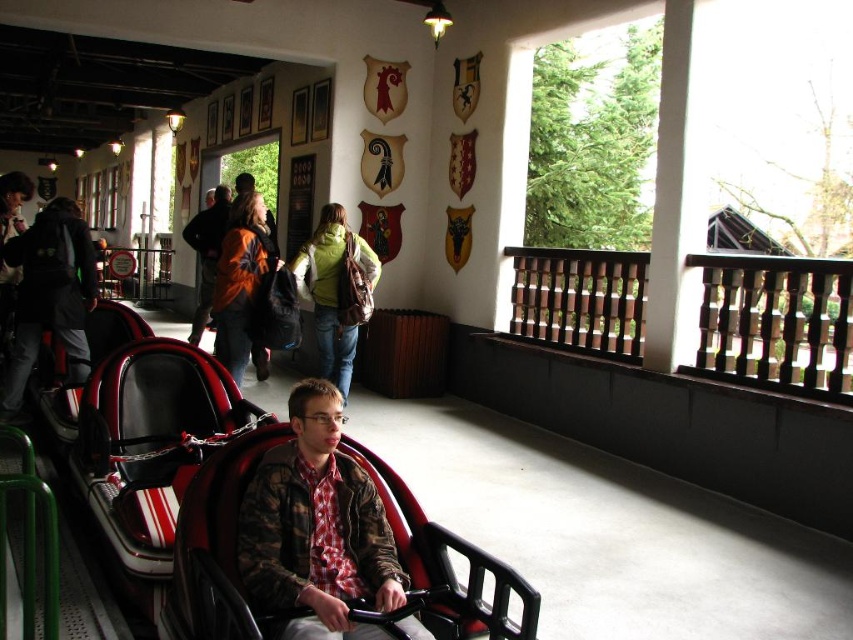
You are standing in the themed medieval amusement park and see the camouflage jacket at center. Can you estimate its position using a coordinate system where the bottom left corner is the origin?

The camouflage jacket at center is located at coordinates approximately 0.825 on the x axis and 0.372 on the y axis.